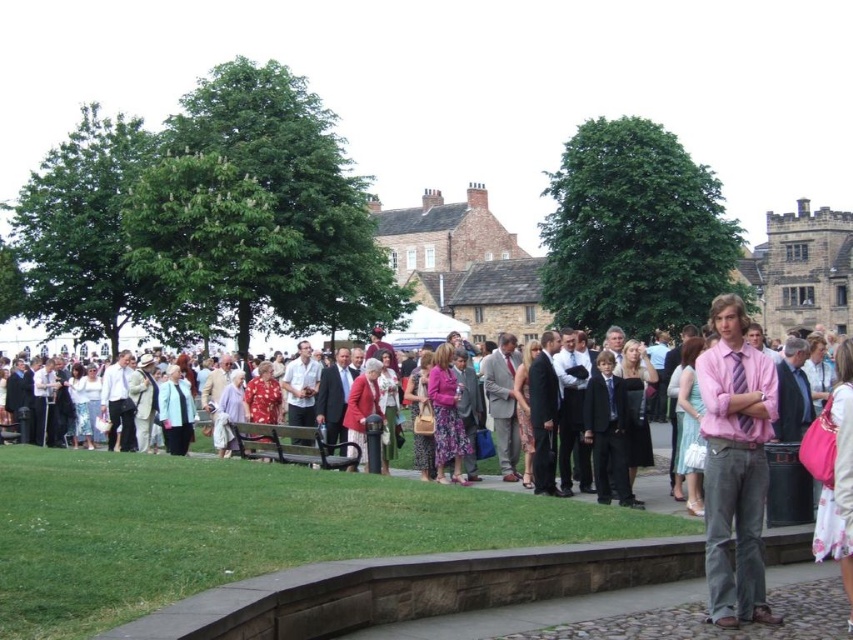
You are organizing a clothing display and need to place the pink silk shirt at center and the pink satin shirt at right on a shelf. The shelf has limited space. Which shirt should you place first to ensure both fit properly?

You should place the pink silk shirt at center first since it has a larger width than the pink satin shirt at right, allowing enough space for both on the shelf.

You are standing at the edge of a crowd in a park, and you need to reach a specific point marked at coordinates point [312,604]. If you can walk 60 meters in a straight line without obstacles, will you be able to reach that point?

The distance between you and the point [312,604] is 54.82 meters, which is less than the 60 meters you can walk. Therefore, you can reach the point.

Looking at this image, you are standing in the crowd at the event and want to move from one spot to another. If you start at point (57, 467) and move towards point (305, 426), will you be moving away from or towards the crowd?

Since point (57, 467) is closer to the viewer than point (305, 426), moving from point (57, 467) to point (305, 426) means you are moving away from the crowd.